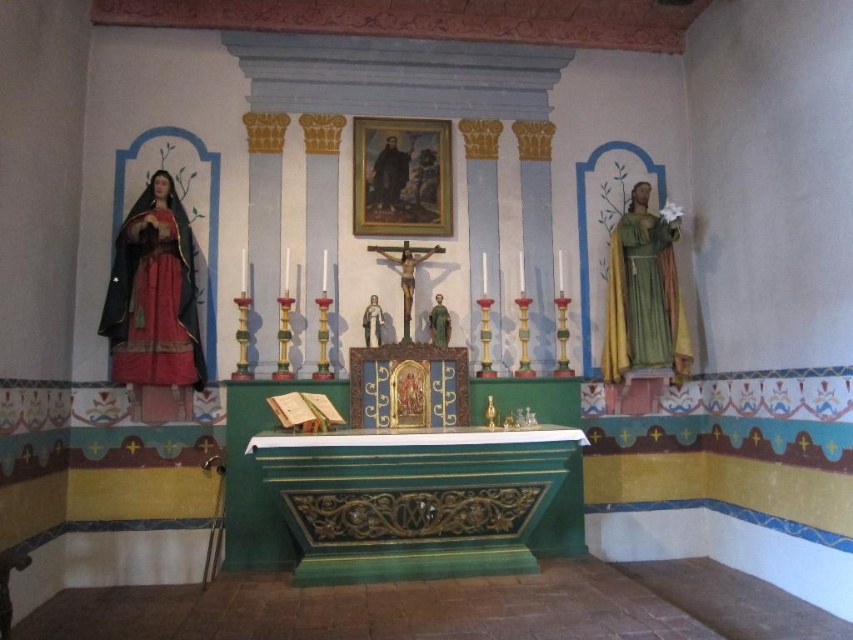
Question: Can you confirm if matte black statue at left is smaller than matte green statue at center?

Choices:
 (A) no
 (B) yes

Answer: (A)

Question: Where is green painted wood altar at center located in relation to matte gold statue at center in the image?

Choices:
 (A) above
 (B) below

Answer: (B)

Question: Which object is the farthest from the green painted wood altar at center?

Choices:
 (A) smooth wooden portrait at upper center
 (B) matte gold statue at center
 (C) matte green statue at right

Answer: (A)

Question: Does green painted wood altar at center come behind matte gold statue at center?

Choices:
 (A) yes
 (B) no

Answer: (B)

Question: Which object is closer to the camera taking this photo?

Choices:
 (A) matte green statue at center
 (B) wooden crucifix at center

Answer: (A)

Question: Estimate the real-world distances between objects in this image. Which object is farther from the matte green statue at center?

Choices:
 (A) wooden crucifix at center
 (B) smooth wooden portrait at upper center
 (C) green painted wood altar at center
 (D) matte green statue at right

Answer: (D)